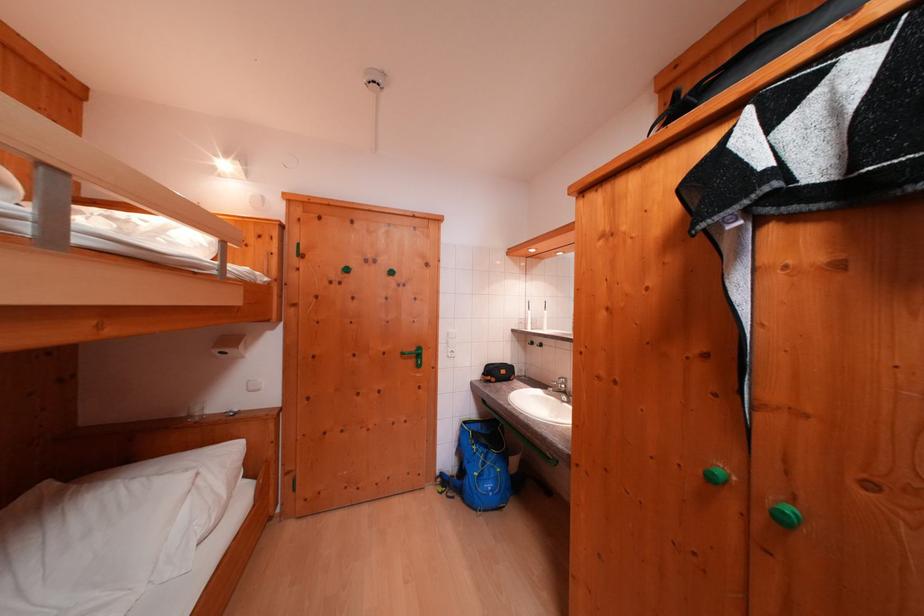
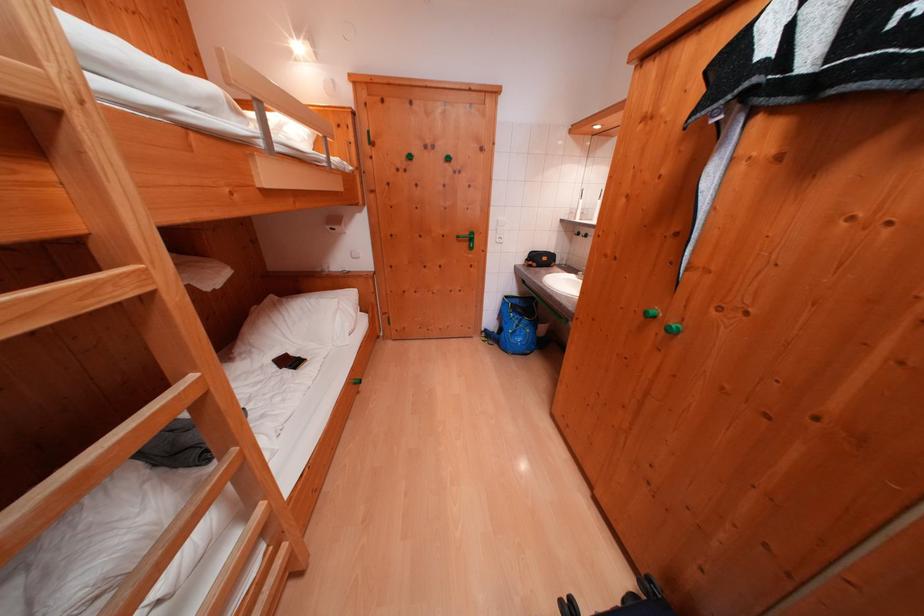
The point at (473,427) is marked in the first image. Where is the corresponding point in the second image?

(515, 301)